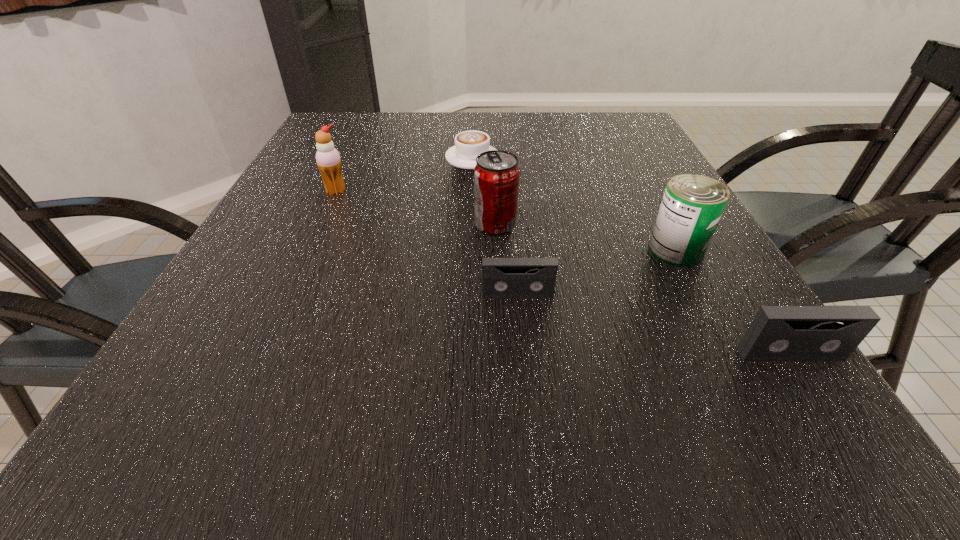
This screenshot has width=960, height=540. Find the location of `free space located on the front-facing side of the fifth tallest object`. free space located on the front-facing side of the fifth tallest object is located at coordinates (521, 334).

The width and height of the screenshot is (960, 540). What are the coordinates of `vacant space situated with the handle on the right side of the cappuccino` in the screenshot? It's located at pyautogui.click(x=473, y=116).

The image size is (960, 540). What are the coordinates of `vacant space positioned 0.130m with the handle on the right side of the cappuccino` in the screenshot? It's located at (473, 126).

Locate an element on the screen. The image size is (960, 540). free space located with the handle on the right side of the cappuccino is located at coordinates (473, 120).

Identify the location of vacant space located on the front of the can. (699, 294).

At what (x,y) coordinates should I click in order to perform the action: click on vacant region located 0.310m at the front with a straw on the leftmost object. Please return your answer as a coordinate pair (x, y). Looking at the image, I should click on (289, 294).

The width and height of the screenshot is (960, 540). In order to click on free location located 0.340m on the left of the pop soda in this screenshot , I will do `click(308, 225)`.

The height and width of the screenshot is (540, 960). What are the coordinates of `object at the far edge` in the screenshot? It's located at (469, 144).

Image resolution: width=960 pixels, height=540 pixels. I want to click on object positioned at the near edge, so click(x=777, y=333).

What are the coordinates of `object situated at the left edge` in the screenshot? It's located at (328, 159).